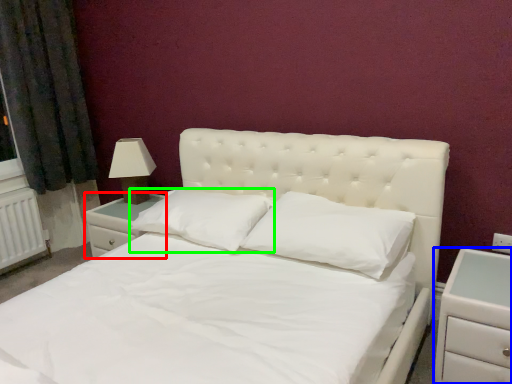
Question: Which is farther away from nightstand (highlighted by a red box)? nightstand (highlighted by a blue box) or pillow (highlighted by a green box)?

Choices:
 (A) nightstand
 (B) pillow

Answer: (A)